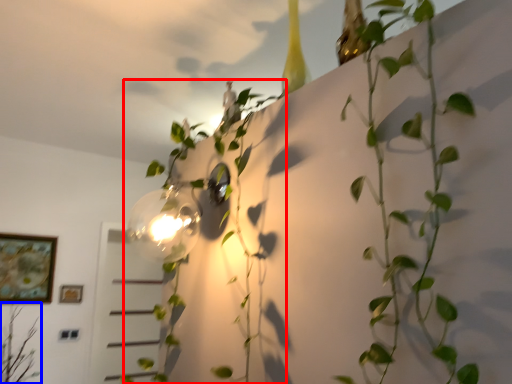
Question: Which object appears farthest to the camera in this image, plant (highlighted by a red box) or plant (highlighted by a blue box)?

Choices:
 (A) plant
 (B) plant

Answer: (B)